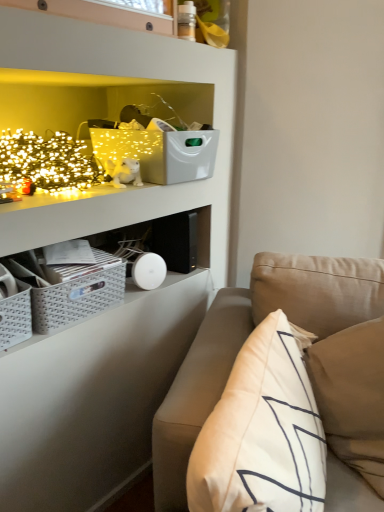
Where is `gray woven crate at lower left`? gray woven crate at lower left is located at coordinates coord(69,289).

What is the approximate width of white soft pillow at right?

white soft pillow at right is 13.86 inches in width.

This screenshot has width=384, height=512. What do you see at coordinates (352, 396) in the screenshot?
I see `white soft pillow at right` at bounding box center [352, 396].

What do you see at coordinates (123, 172) in the screenshot? The width and height of the screenshot is (384, 512). I see `white plush cat at upper left` at bounding box center [123, 172].

In order to click on gray woven crate at lower left in this screenshot , I will do `click(69, 289)`.

Which object is further away from the camera, beige fabric couch at lower right or white soft pillow at right?

white soft pillow at right.

How many degrees apart are the facing directions of beige fabric couch at lower right and white soft pillow at right?

The angle between the facing direction of beige fabric couch at lower right and the facing direction of white soft pillow at right is 1.69 degrees.

From a real-world perspective, which object rests below the other?

In real-world perspective, beige fabric couch at lower right is lower.

Locate an element on the screen. Image resolution: width=384 pixels, height=512 pixels. pillow on the right of beige fabric couch at lower right is located at coordinates (352, 396).

Considering the relative positions of white plush cat at upper left and beige fabric couch at lower right in the image provided, is white plush cat at upper left to the left of beige fabric couch at lower right from the viewer's perspective?

Indeed, white plush cat at upper left is positioned on the left side of beige fabric couch at lower right.

The height and width of the screenshot is (512, 384). What are the coordinates of `toy on the left of beige fabric couch at lower right` in the screenshot? It's located at (123, 172).

Is white plush cat at upper left shorter than beige fabric couch at lower right?

Yes, white plush cat at upper left is shorter than beige fabric couch at lower right.

Looking at this image, is white plush cat at upper left not near beige fabric couch at lower right?

That's not correct — white plush cat at upper left is a little close to beige fabric couch at lower right.

Considering the relative sizes of beige fabric couch at lower right and gray woven crate at lower left in the image provided, is beige fabric couch at lower right taller than gray woven crate at lower left?

Yes.

Considering the sizes of objects beige fabric couch at lower right and gray woven crate at lower left in the image provided, who is wider, beige fabric couch at lower right or gray woven crate at lower left?

Wider between the two is beige fabric couch at lower right.

In order to click on crate that is on the left side of beige fabric couch at lower right in this screenshot , I will do `click(69, 289)`.

Considering the sizes of objects gray woven crate at lower left and white plush cat at upper left in the image provided, who is smaller, gray woven crate at lower left or white plush cat at upper left?

white plush cat at upper left is smaller.

How many degrees apart are the facing directions of gray woven crate at lower left and white plush cat at upper left?

The angular difference between gray woven crate at lower left and white plush cat at upper left is 4.08 degrees.

Does point (92, 303) lie in front of point (114, 164)?

That is True.

Is gray woven crate at lower left aimed at white plush cat at upper left?

No.

Can you confirm if gray woven crate at lower left is smaller than white soft pillow at right?

Yes, gray woven crate at lower left is smaller than white soft pillow at right.

How many degrees apart are the facing directions of gray woven crate at lower left and white soft pillow at right?

gray woven crate at lower left and white soft pillow at right are facing 67.7 degrees away from each other.

In the scene shown: Is gray woven crate at lower left touching white soft pillow at right?

gray woven crate at lower left is not next to white soft pillow at right, and they're not touching.

Is gray woven crate at lower left not within white soft pillow at right?

Absolutely, gray woven crate at lower left is external to white soft pillow at right.

Would you say white plush cat at upper left is inside or outside gray woven crate at lower left?

white plush cat at upper left is spatially situated outside gray woven crate at lower left.

Looking at this image, from the image's perspective, would you say white plush cat at upper left is shown under gray woven crate at lower left?

No, from the image's perspective, white plush cat at upper left is not below gray woven crate at lower left.

In the image, is white plush cat at upper left on the left side or the right side of gray woven crate at lower left?

Clearly, white plush cat at upper left is on the right of gray woven crate at lower left in the image.

Who is bigger, beige fabric couch at lower right or white plush cat at upper left?

beige fabric couch at lower right is bigger.

Is beige fabric couch at lower right positioned far away from white plush cat at upper left?

beige fabric couch at lower right is actually quite close to white plush cat at upper left.

Can you tell me how much beige fabric couch at lower right and white plush cat at upper left differ in facing direction?

beige fabric couch at lower right and white plush cat at upper left are facing 65.3 degrees away from each other.

From a real-world perspective, which is physically below, beige fabric couch at lower right or white plush cat at upper left?

In real-world perspective, beige fabric couch at lower right is lower.

You are a GUI agent. You are given a task and a screenshot of the screen. Output one action in this format:
    pyautogui.click(x=<x>, y=<y>)
    Task: Click on the studio couch in front of the white soft pillow at right
    
    Given the screenshot: What is the action you would take?
    pyautogui.click(x=306, y=364)

The image size is (384, 512). I want to click on toy behind the beige fabric couch at lower right, so click(123, 172).

Based on their spatial positions, is gray woven crate at lower left or white plush cat at upper left closer to beige fabric couch at lower right?

gray woven crate at lower left lies closer to beige fabric couch at lower right than the other object.

From the image, which object appears to be farther from beige fabric couch at lower right, white soft pillow at right or gray woven crate at lower left?

Based on the image, gray woven crate at lower left appears to be further to beige fabric couch at lower right.

Which object lies further to the anchor point white plush cat at upper left, beige fabric couch at lower right or white soft pillow at right?

white soft pillow at right is positioned further to the anchor white plush cat at upper left.

Estimate the real-world distances between objects in this image. Which object is further from beige fabric couch at lower right, white plush cat at upper left or gray woven crate at lower left?

Based on the image, white plush cat at upper left appears to be further to beige fabric couch at lower right.

Considering their positions, is gray woven crate at lower left positioned further to white soft pillow at right than beige fabric couch at lower right?

The object further to white soft pillow at right is gray woven crate at lower left.

From the image, which object appears to be farther from beige fabric couch at lower right, gray woven crate at lower left or white soft pillow at right?

gray woven crate at lower left lies further to beige fabric couch at lower right than the other object.

From the image, which object appears to be farther from white plush cat at upper left, white soft pillow at right or gray woven crate at lower left?

Result: Based on the image, white soft pillow at right appears to be further to white plush cat at upper left.

When comparing their distances from white soft pillow at right, does white plush cat at upper left or gray woven crate at lower left seem further?

white plush cat at upper left.

Identify the location of toy located between gray woven crate at lower left and white soft pillow at right in the left-right direction. (123, 172).

At what (x,y) coordinates should I click in order to perform the action: click on studio couch between gray woven crate at lower left and white soft pillow at right. Please return your answer as a coordinate pair (x, y). This screenshot has height=512, width=384. Looking at the image, I should click on (306, 364).

At what (x,y) coordinates should I click in order to perform the action: click on pillow between beige fabric couch at lower right and white plush cat at upper left in the front-back direction. Please return your answer as a coordinate pair (x, y). This screenshot has height=512, width=384. Looking at the image, I should click on (352, 396).

You are a GUI agent. You are given a task and a screenshot of the screen. Output one action in this format:
    pyautogui.click(x=<x>, y=<y>)
    Task: Click on the crate between beige fabric couch at lower right and white plush cat at upper left along the z-axis
    
    Given the screenshot: What is the action you would take?
    pyautogui.click(x=69, y=289)